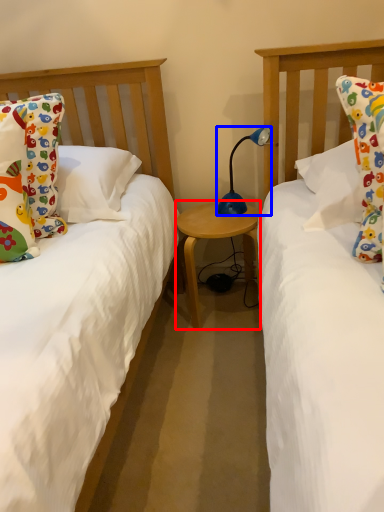
Question: Which of the following is the closest to the observer, table (highlighted by a red box) or lamp (highlighted by a blue box)?

Choices:
 (A) table
 (B) lamp

Answer: (B)